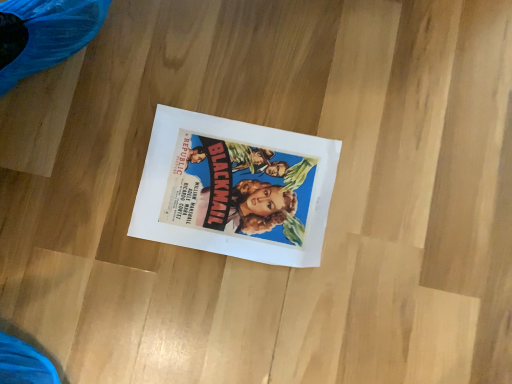
Locate an element on the screen. The height and width of the screenshot is (384, 512). blank space situated above white paper at center (from a real-world perspective) is located at coordinates (238, 189).